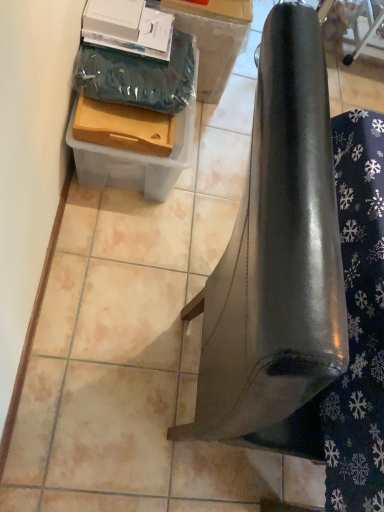
Describe the element at coordinates (214, 39) in the screenshot. The image size is (384, 512). I see `cardboard box at upper left, the first cardboard box in the top-to-bottom sequence` at that location.

This screenshot has width=384, height=512. Find the location of `glossy metallic punching bag at right`. glossy metallic punching bag at right is located at coordinates (277, 263).

What do you see at coordinates (277, 263) in the screenshot?
I see `glossy metallic punching bag at right` at bounding box center [277, 263].

Locate an element on the screen. matte plastic box at upper left, the second cardboard box viewed from the top is located at coordinates pos(137,103).

Can you confirm if matte plastic box at upper left, the first cardboard box from the bottom, is shorter than wooden drawer at upper left?

No.

Based on the photo, choose the correct answer: Is matte plastic box at upper left, the second cardboard box viewed from the top, inside wooden drawer at upper left or outside it?

matte plastic box at upper left, the second cardboard box viewed from the top, is outside wooden drawer at upper left.

From a real-world perspective, which object stands above the other?

From a 3D spatial view, wooden drawer at upper left is above.

Is matte plastic box at upper left, the first cardboard box from the bottom, oriented away from wooden drawer at upper left?

No, wooden drawer at upper left is not at the back of matte plastic box at upper left, the first cardboard box from the bottom.

Is glossy metallic punching bag at right oriented towards cardboard box at upper left, positioned as the second cardboard box in bottom-to-top order?

No, glossy metallic punching bag at right does not turn towards cardboard box at upper left, positioned as the second cardboard box in bottom-to-top order.

Is glossy metallic punching bag at right with cardboard box at upper left, positioned as the second cardboard box in bottom-to-top order?

No, glossy metallic punching bag at right is not touching cardboard box at upper left, positioned as the second cardboard box in bottom-to-top order.

Which is more to the right, glossy metallic punching bag at right or cardboard box at upper left, positioned as the second cardboard box in bottom-to-top order?

glossy metallic punching bag at right.

From a real-world perspective, is glossy metallic punching bag at right positioned above or below cardboard box at upper left, positioned as the second cardboard box in bottom-to-top order?

From a real-world perspective, glossy metallic punching bag at right is physically above cardboard box at upper left, positioned as the second cardboard box in bottom-to-top order.

Is point (155, 117) closer to viewer compared to point (97, 188)?

Yes, it is.

From the image's perspective, between wooden drawer at upper left and matte plastic box at upper left, the second cardboard box viewed from the top, which one is located above?

wooden drawer at upper left, from the image's perspective.

Does wooden drawer at upper left turn towards matte plastic box at upper left, the second cardboard box viewed from the top?

No, wooden drawer at upper left is not turned towards matte plastic box at upper left, the second cardboard box viewed from the top.

Considering the relative positions of wooden drawer at upper left and matte plastic box at upper left, the first cardboard box from the bottom, in the image provided, is wooden drawer at upper left to the left or to the right of matte plastic box at upper left, the first cardboard box from the bottom,?

In the image, wooden drawer at upper left appears on the right side of matte plastic box at upper left, the first cardboard box from the bottom.

How different are the orientations of matte plastic box at upper left, the first cardboard box from the bottom, and glossy metallic punching bag at right in degrees?

0.629 degrees separate the facing orientations of matte plastic box at upper left, the first cardboard box from the bottom, and glossy metallic punching bag at right.

Considering the positions of point (190, 128) and point (306, 7), is point (190, 128) closer or farther from the camera than point (306, 7)?

Clearly, point (190, 128) is more distant from the camera than point (306, 7).

Does matte plastic box at upper left, the first cardboard box from the bottom, come in front of glossy metallic punching bag at right?

That is False.

Considering the sizes of objects matte plastic box at upper left, the second cardboard box viewed from the top, and glossy metallic punching bag at right in the image provided, who is smaller, matte plastic box at upper left, the second cardboard box viewed from the top, or glossy metallic punching bag at right?

Smaller between the two is matte plastic box at upper left, the second cardboard box viewed from the top.

How far apart are matte plastic box at upper left, the second cardboard box viewed from the top, and cardboard box at upper left, the first cardboard box in the top-to-bottom sequence?

matte plastic box at upper left, the second cardboard box viewed from the top, and cardboard box at upper left, the first cardboard box in the top-to-bottom sequence, are 12.05 inches apart from each other.

Is matte plastic box at upper left, the second cardboard box viewed from the top, in front of or behind cardboard box at upper left, positioned as the second cardboard box in bottom-to-top order, in the image?

matte plastic box at upper left, the second cardboard box viewed from the top, is positioned closer to the viewer than cardboard box at upper left, positioned as the second cardboard box in bottom-to-top order.

Is cardboard box at upper left, positioned as the second cardboard box in bottom-to-top order, completely or partially inside matte plastic box at upper left, the first cardboard box from the bottom?

Definitely not — cardboard box at upper left, positioned as the second cardboard box in bottom-to-top order, is not inside matte plastic box at upper left, the first cardboard box from the bottom.

Who is taller, matte plastic box at upper left, the second cardboard box viewed from the top, or cardboard box at upper left, the first cardboard box in the top-to-bottom sequence?

Standing taller between the two is cardboard box at upper left, the first cardboard box in the top-to-bottom sequence.

Who is taller, wooden drawer at upper left or glossy metallic punching bag at right?

With more height is glossy metallic punching bag at right.

Is wooden drawer at upper left closer to the viewer compared to glossy metallic punching bag at right?

No, it is not.

From a real-world perspective, is wooden drawer at upper left physically above glossy metallic punching bag at right?

No, from a real-world perspective, wooden drawer at upper left is not over glossy metallic punching bag at right

Is glossy metallic punching bag at right located within wooden drawer at upper left?

Answer: Definitely not — glossy metallic punching bag at right is not inside wooden drawer at upper left.

Can you tell me how much glossy metallic punching bag at right and wooden drawer at upper left differ in facing direction?

There is a 0.49-degree angle between the facing directions of glossy metallic punching bag at right and wooden drawer at upper left.

Are glossy metallic punching bag at right and wooden drawer at upper left making contact?

No, glossy metallic punching bag at right is not beside wooden drawer at upper left.

Could you tell me if glossy metallic punching bag at right is turned towards wooden drawer at upper left?

No, glossy metallic punching bag at right is not aimed at wooden drawer at upper left.

Is glossy metallic punching bag at right not within wooden drawer at upper left?

glossy metallic punching bag at right lies outside wooden drawer at upper left's area.

This screenshot has width=384, height=512. Identify the location of cardboard box on the left of the wooden drawer at upper left. (137, 103).

This screenshot has width=384, height=512. Identify the location of the 2nd cardboard box behind the glossy metallic punching bag at right, counting from the anchor's position. (214, 39).

From the image, which object appears to be farther from matte plastic box at upper left, the first cardboard box from the bottom, cardboard box at upper left, the first cardboard box in the top-to-bottom sequence, or wooden drawer at upper left?

cardboard box at upper left, the first cardboard box in the top-to-bottom sequence, is positioned further to the anchor matte plastic box at upper left, the first cardboard box from the bottom.

Consider the image. When comparing their distances from glossy metallic punching bag at right, does cardboard box at upper left, positioned as the second cardboard box in bottom-to-top order, or wooden drawer at upper left seem closer?

wooden drawer at upper left lies closer to glossy metallic punching bag at right than the other object.

Estimate the real-world distances between objects in this image. Which object is closer to wooden drawer at upper left, cardboard box at upper left, positioned as the second cardboard box in bottom-to-top order, or glossy metallic punching bag at right?

Among the two, cardboard box at upper left, positioned as the second cardboard box in bottom-to-top order, is located nearer to wooden drawer at upper left.

When comparing their distances from wooden drawer at upper left, does cardboard box at upper left, positioned as the second cardboard box in bottom-to-top order, or matte plastic box at upper left, the second cardboard box viewed from the top, seem further?

The object further to wooden drawer at upper left is cardboard box at upper left, positioned as the second cardboard box in bottom-to-top order.

Based on their spatial positions, is wooden drawer at upper left or cardboard box at upper left, the first cardboard box in the top-to-bottom sequence, further from glossy metallic punching bag at right?

Based on the image, cardboard box at upper left, the first cardboard box in the top-to-bottom sequence, appears to be further to glossy metallic punching bag at right.

When comparing their distances from wooden drawer at upper left, does matte plastic box at upper left, the first cardboard box from the bottom, or cardboard box at upper left, positioned as the second cardboard box in bottom-to-top order, seem further?

cardboard box at upper left, positioned as the second cardboard box in bottom-to-top order, lies further to wooden drawer at upper left than the other object.

When comparing their distances from cardboard box at upper left, positioned as the second cardboard box in bottom-to-top order, does wooden drawer at upper left or glossy metallic punching bag at right seem further?

glossy metallic punching bag at right is positioned further to the anchor cardboard box at upper left, positioned as the second cardboard box in bottom-to-top order.

From the image, which object appears to be farther from glossy metallic punching bag at right, matte plastic box at upper left, the first cardboard box from the bottom, or cardboard box at upper left, positioned as the second cardboard box in bottom-to-top order?

Among the two, cardboard box at upper left, positioned as the second cardboard box in bottom-to-top order, is located further to glossy metallic punching bag at right.

I want to click on drawer between glossy metallic punching bag at right and matte plastic box at upper left, the second cardboard box viewed from the top, in the front-back direction, so click(x=124, y=127).

The height and width of the screenshot is (512, 384). I want to click on drawer between glossy metallic punching bag at right and cardboard box at upper left, the first cardboard box in the top-to-bottom sequence, along the z-axis, so click(x=124, y=127).

The width and height of the screenshot is (384, 512). Find the location of `cardboard box positioned between glossy metallic punching bag at right and cardboard box at upper left, positioned as the second cardboard box in bottom-to-top order, from near to far`. cardboard box positioned between glossy metallic punching bag at right and cardboard box at upper left, positioned as the second cardboard box in bottom-to-top order, from near to far is located at coordinates (137, 103).

At what (x,y) coordinates should I click in order to perform the action: click on drawer between cardboard box at upper left, positioned as the second cardboard box in bottom-to-top order, and matte plastic box at upper left, the second cardboard box viewed from the top, in the up-down direction. Please return your answer as a coordinate pair (x, y). This screenshot has width=384, height=512. Looking at the image, I should click on (124, 127).